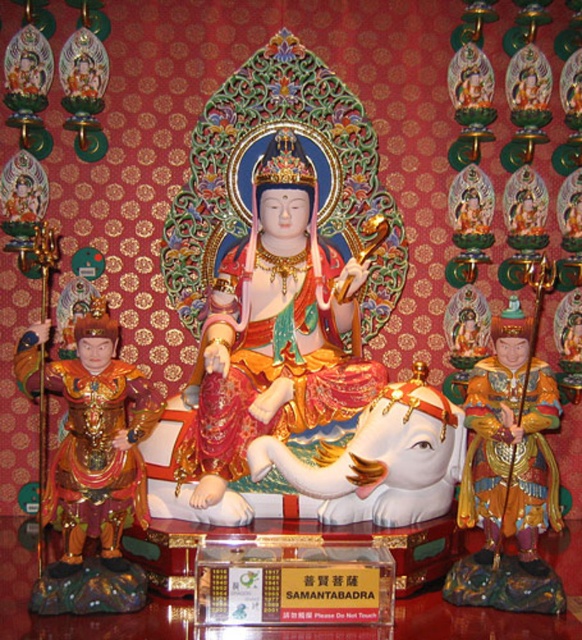
Question: Which of these objects is positioned closest to the gold lacquered statue at left?

Choices:
 (A) gold glossy statue at right
 (B) glossy gold statue at center

Answer: (B)

Question: Among these objects, which one is nearest to the camera?

Choices:
 (A) glossy gold statue at center
 (B) gold lacquered statue at left
 (C) gold glossy statue at right

Answer: (C)

Question: Which of these objects is positioned farthest from the glossy gold statue at center?

Choices:
 (A) gold glossy statue at right
 (B) gold lacquered statue at left

Answer: (A)

Question: Is glossy gold statue at center smaller than gold lacquered statue at left?

Choices:
 (A) no
 (B) yes

Answer: (A)

Question: Can you confirm if glossy gold statue at center is bigger than gold lacquered statue at left?

Choices:
 (A) no
 (B) yes

Answer: (B)

Question: Is glossy gold statue at center to the right of gold lacquered statue at left from the viewer's perspective?

Choices:
 (A) no
 (B) yes

Answer: (B)